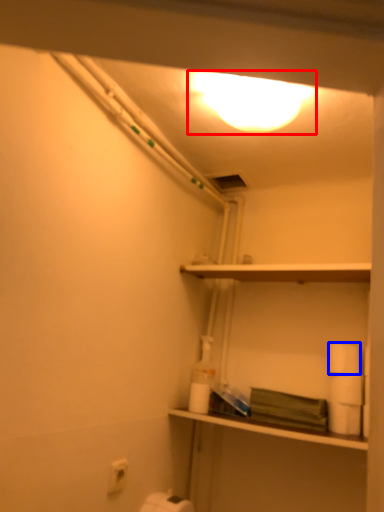
Question: Which point is further to the camera, lighting (highlighted by a red box) or toilet paper (highlighted by a blue box)?

Choices:
 (A) lighting
 (B) toilet paper

Answer: (B)